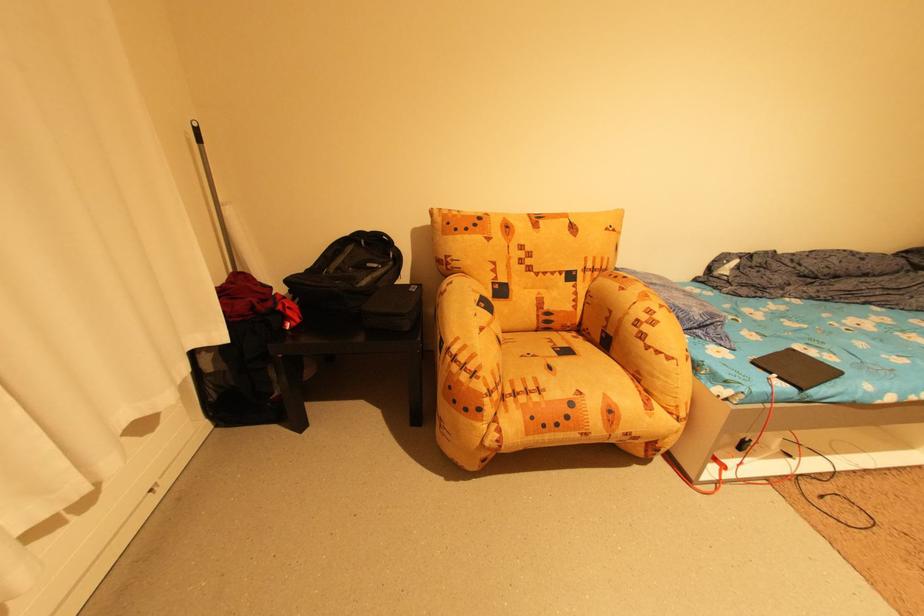
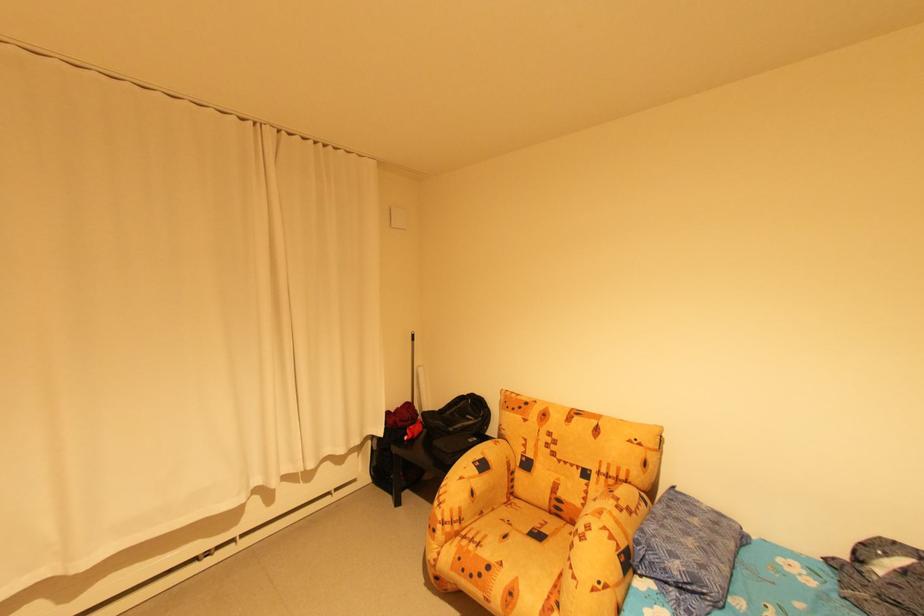
Locate, in the second image, the point that corresponds to point (391, 265) in the first image.

(482, 419)